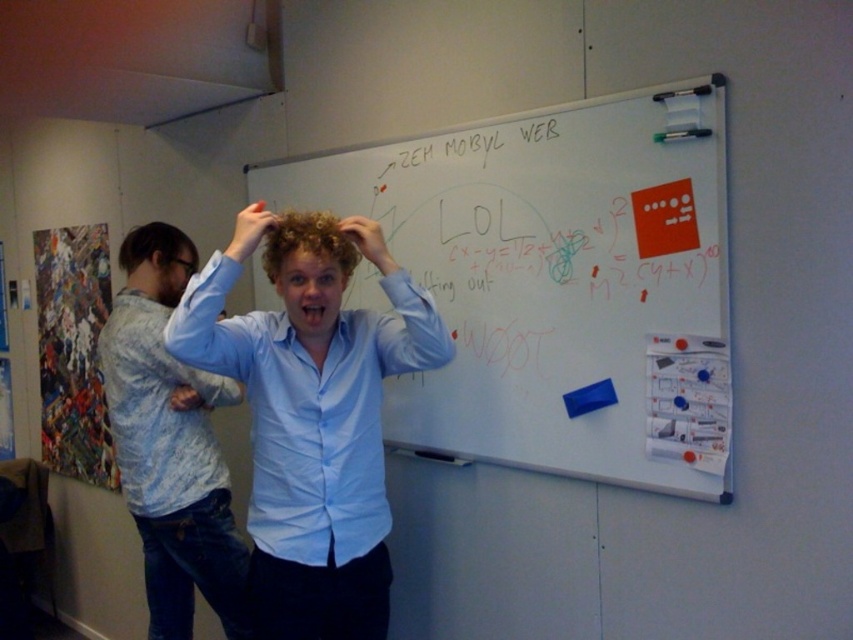
Question: Does whiteboard at center come in front of blue cotton shirt at center?

Choices:
 (A) no
 (B) yes

Answer: (B)

Question: Which point is farther to the camera?

Choices:
 (A) curly hair at center
 (B) matte skin at center

Answer: (A)

Question: Can you confirm if matte blue shirt at left is wider than curly hair at center?

Choices:
 (A) yes
 (B) no

Answer: (A)

Question: Which point is closer to the camera?

Choices:
 (A) light blue shirt at center
 (B) blue cotton shirt at center
 (C) curly hair at center
 (D) whiteboard at center

Answer: (A)

Question: Which object is the closest to the curly blonde hair at center?

Choices:
 (A) light blue shirt at center
 (B) matte skin at center
 (C) curly hair at center
 (D) blue cotton shirt at center

Answer: (C)

Question: Is light blue shirt at center thinner than matte skin at center?

Choices:
 (A) yes
 (B) no

Answer: (B)